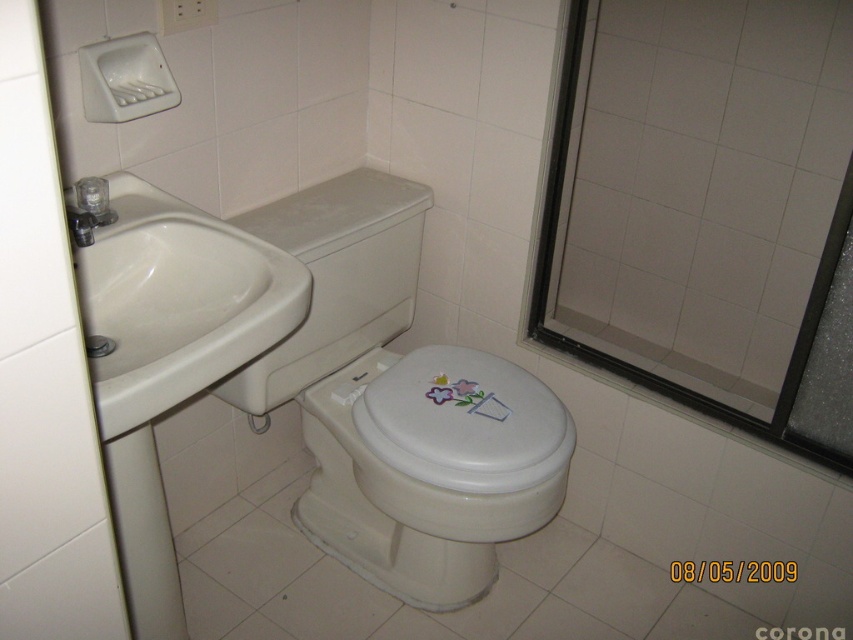
Question: Which object is the closest to the white glossy toilet at center?

Choices:
 (A) transparent glass door at upper right
 (B) transparent glass screen door at right
 (C) white glossy bidet at center
 (D) white glossy toilet lid at center

Answer: (C)

Question: Does white glossy toilet at center have a greater width compared to white glossy toilet lid at center?

Choices:
 (A) no
 (B) yes

Answer: (B)

Question: Does white glossy sink at left have a larger size compared to white glossy toilet lid at center?

Choices:
 (A) no
 (B) yes

Answer: (B)

Question: Which is nearer to the white glossy toilet at center?

Choices:
 (A) transparent glass screen door at right
 (B) white glossy bidet at center
 (C) white glossy toilet lid at center

Answer: (B)

Question: Does transparent glass door at upper right appear on the right side of matte silver faucet at left?

Choices:
 (A) no
 (B) yes

Answer: (B)

Question: Which point is closer to the camera taking this photo?

Choices:
 (A) (416, 417)
 (B) (80, 250)
 (C) (320, 456)
 (D) (834, 275)

Answer: (B)